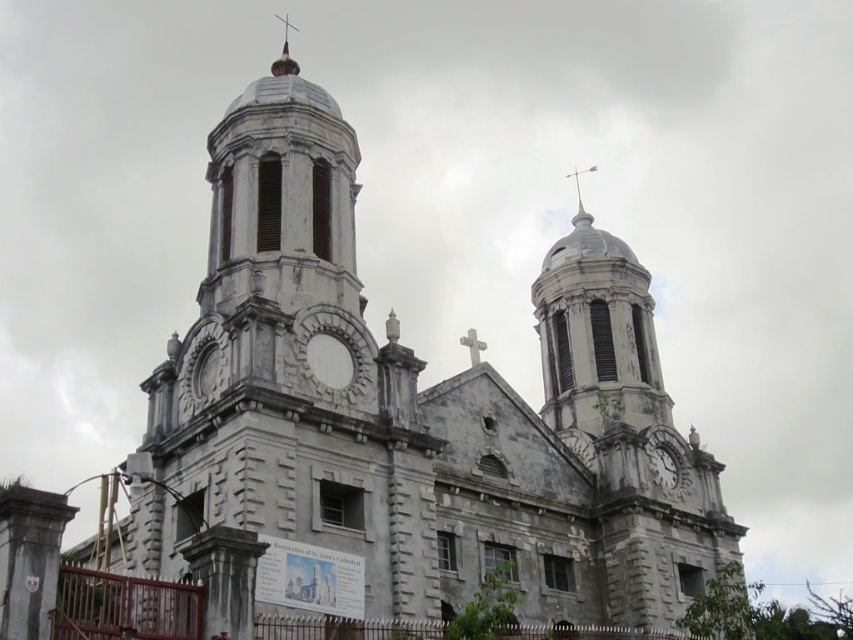
Question: Which point is farther from the camera taking this photo?

Choices:
 (A) (573, 177)
 (B) (668, 480)

Answer: (A)

Question: Is white stone dome at upper center below white stone spire at upper center?

Choices:
 (A) yes
 (B) no

Answer: (A)

Question: Can you confirm if white stone clock at center is wider than white stone spire at upper center?

Choices:
 (A) no
 (B) yes

Answer: (A)

Question: Which of these objects is positioned farthest from the gray stone clock tower at center?

Choices:
 (A) white stone spire at upper center
 (B) white stone dome at upper center

Answer: (A)

Question: Is gray stone clock tower at center below white stone spire at upper center?

Choices:
 (A) no
 (B) yes

Answer: (A)

Question: Which object is farther from the camera taking this photo?

Choices:
 (A) white stone clock at center
 (B) gray stone clock tower at center
 (C) white stone dome at upper center

Answer: (A)